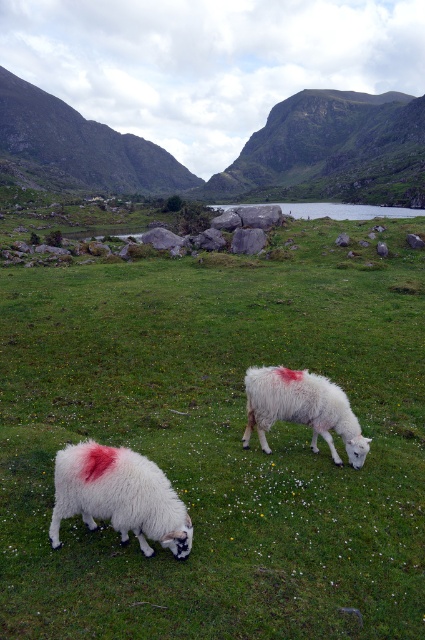
Is the position of white woolen sheep at center less distant than that of green smooth water at center?

Yes, it is in front of green smooth water at center.

Is point (5, 401) closer to viewer compared to point (322, 211)?

Yes, point (5, 401) is in front of point (322, 211).

I want to click on white woolen sheep at center, so click(x=218, y=442).

Does green grassy hillside at upper center have a larger size compared to green smooth water at center?

Correct, green grassy hillside at upper center is larger in size than green smooth water at center.

Is point (34, 148) positioned before point (363, 212)?

No.

Find the location of a particular element. This screenshot has height=640, width=425. green grassy hillside at upper center is located at coordinates (240, 152).

Does green grassy hillside at upper center lie in front of white woolly sheep at center?

No, green grassy hillside at upper center is behind white woolly sheep at center.

Can you confirm if green grassy hillside at upper center is wider than white woolly sheep at center?

Indeed, green grassy hillside at upper center has a greater width compared to white woolly sheep at center.

Which is behind, point (122, 150) or point (316, 385)?

The point (122, 150) is behind.

Where is `green grassy hillside at upper center`? green grassy hillside at upper center is located at coordinates (240, 152).